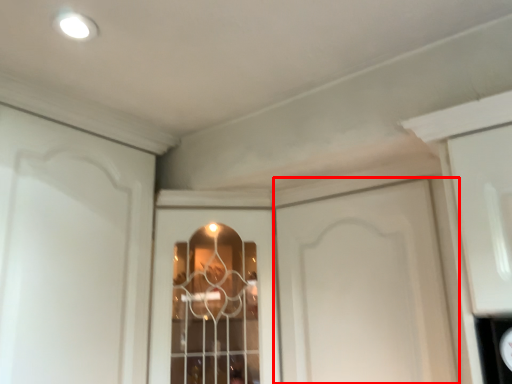
Question: From the image's perspective, where is door (annotated by the red box) located in relation to window in the image?

Choices:
 (A) above
 (B) below

Answer: (A)